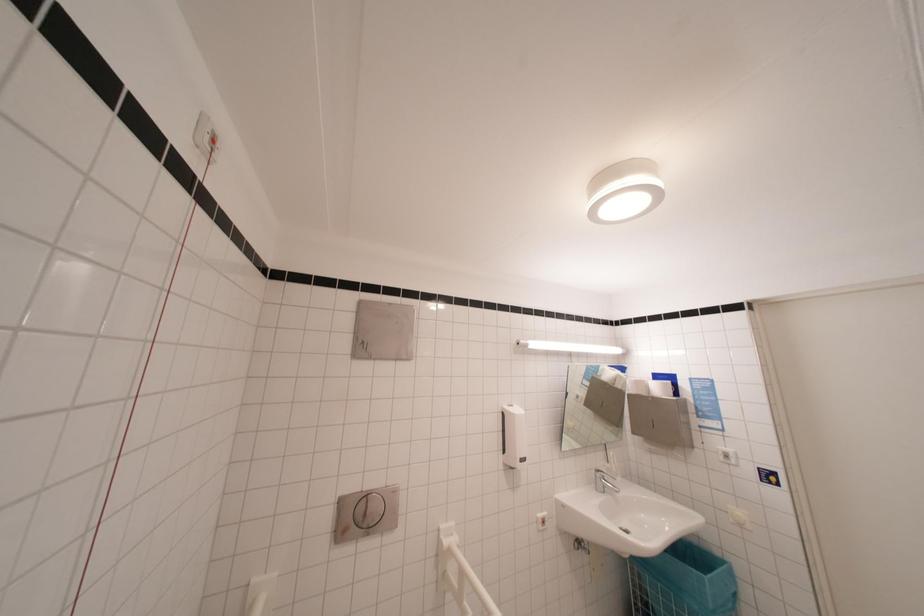
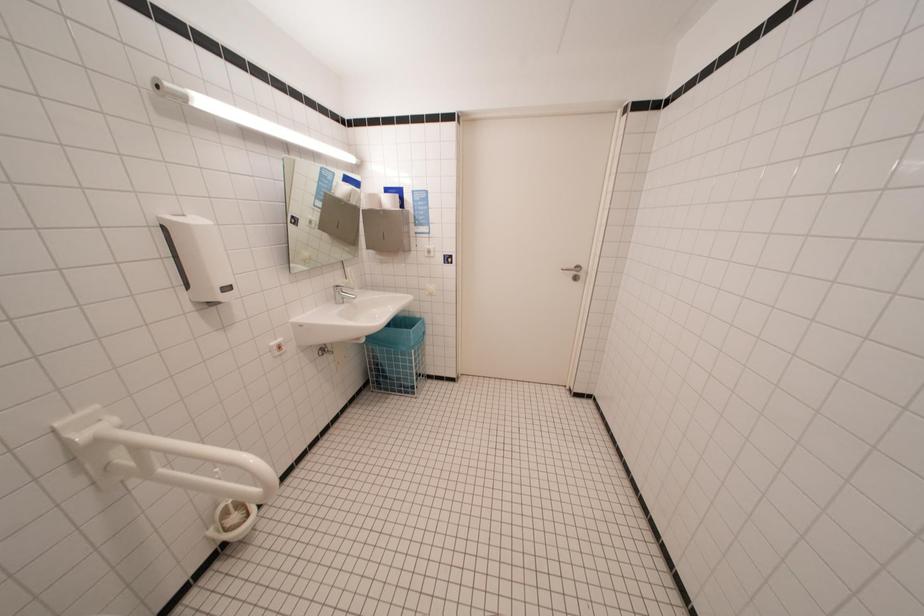
Based on the continuous images, in which direction is the camera rotating?

The camera's rotation is toward right-down.